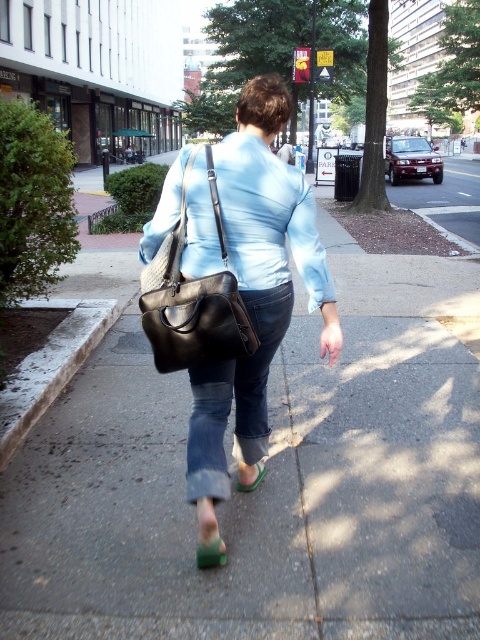
Who is more forward, (237,433) or (210,560)?

Point (210,560) is in front.

Can you confirm if matte black bag at center is thinner than green rubber sandal at lower center?

Incorrect, matte black bag at center's width is not less than green rubber sandal at lower center's.

Locate an element on the screen. The width and height of the screenshot is (480, 640). matte black bag at center is located at coordinates (231, 285).

Which is more to the left, green rubber sandal at lower center or green suede sandal at lower center?

Positioned to the left is green rubber sandal at lower center.

Is point (225, 550) positioned behind point (244, 486)?

No, (225, 550) is closer to viewer.

Where is `green rubber sandal at lower center`? green rubber sandal at lower center is located at coordinates (211, 554).

Between matte black bag at center and green suede sandal at lower center, which one has less height?

green suede sandal at lower center is shorter.

Measure the distance between matte black bag at center and green suede sandal at lower center.

matte black bag at center and green suede sandal at lower center are 22.29 inches apart.

Is point (260, 150) closer to camera compared to point (263, 468)?

Yes, point (260, 150) is closer to viewer.

Where is `matte black bag at center`? The width and height of the screenshot is (480, 640). matte black bag at center is located at coordinates (231, 285).